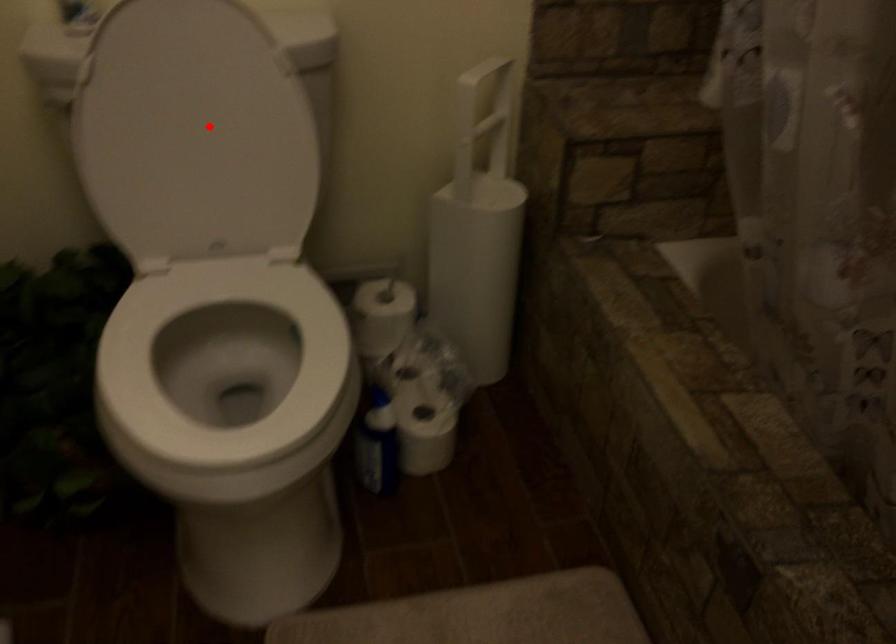
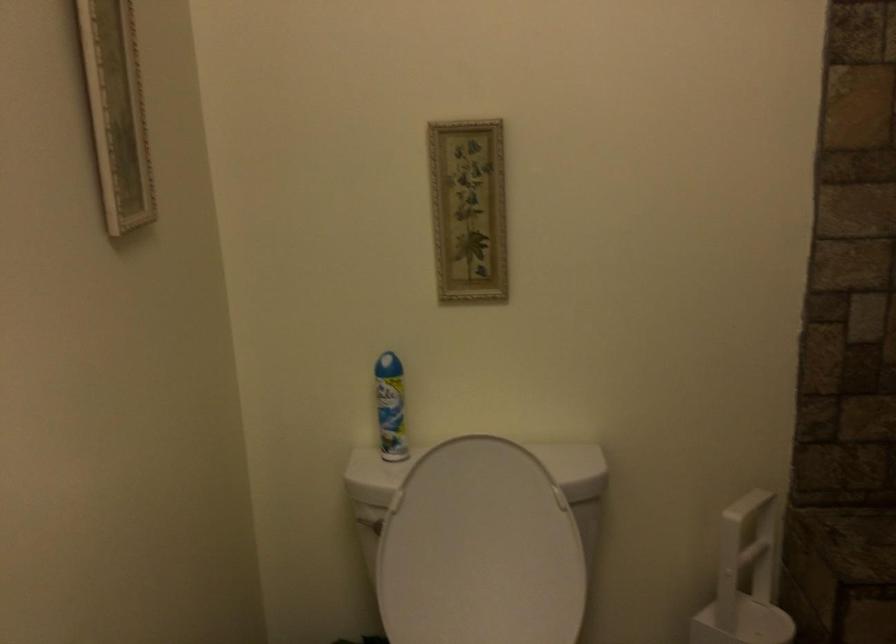
In the second image, find the point that corresponds to the highlighted location in the first image.

(479, 550)